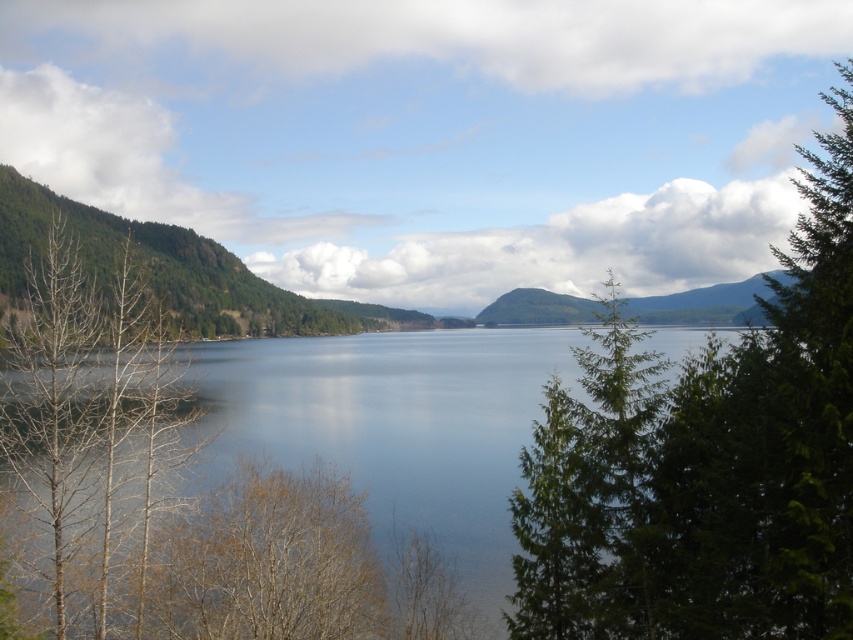
Question: Which point is farther to the camera?

Choices:
 (A) (606, 332)
 (B) (38, 492)
 (C) (747, 296)
 (D) (503, 605)

Answer: (C)

Question: Among these points, which one is farthest from the camera?

Choices:
 (A) (827, 589)
 (B) (437, 500)
 (C) (48, 486)
 (D) (500, 305)

Answer: (D)

Question: Is transparent water at center further to the viewer compared to green forested mountain at center?

Choices:
 (A) no
 (B) yes

Answer: (B)

Question: In this image, where is green textured tree at right located relative to transparent water at center?

Choices:
 (A) left
 (B) right

Answer: (B)

Question: Among these points, which one is nearest to the camera?

Choices:
 (A) (849, 176)
 (B) (90, 294)

Answer: (A)

Question: Does green textured tree at right appear on the right side of transparent water at center?

Choices:
 (A) yes
 (B) no

Answer: (A)